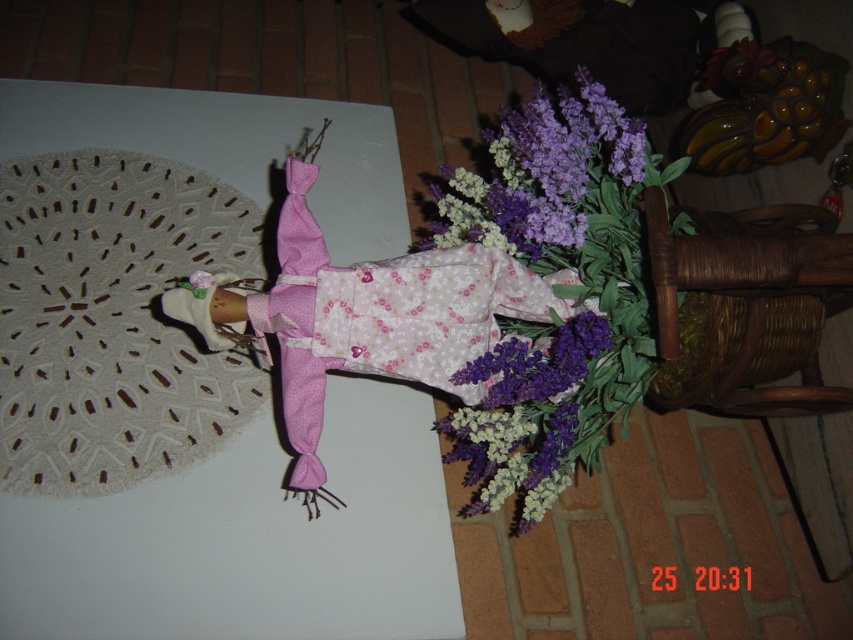
You are a photographer adjusting the lighting for a product shoot of a doll holding a lavender bouquet. The doll is positioned at point [554,291]. Where should you place the main light to ensure the lavender bouquet at center is well lit?

The point [554,291] indicates the lavender bouquet at center, so place the main light directly in front of that point to ensure the lavender bouquet at center is well lit.